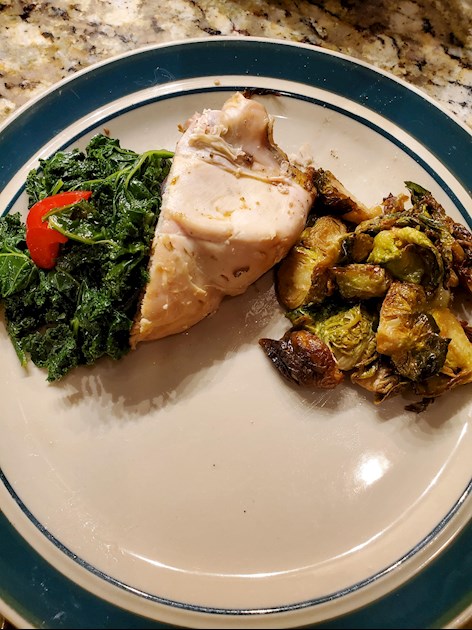
Where is `plate`? plate is located at coordinates (244, 501).